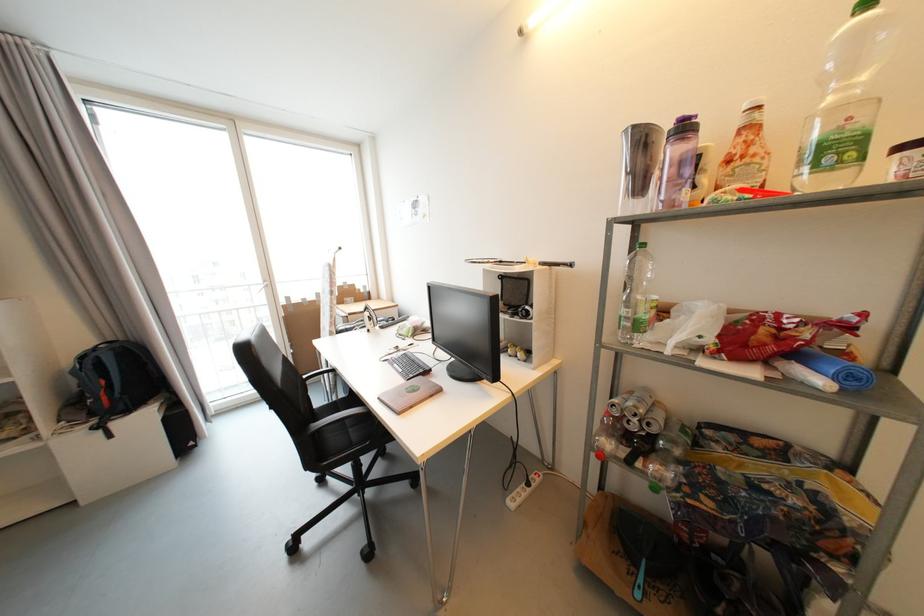
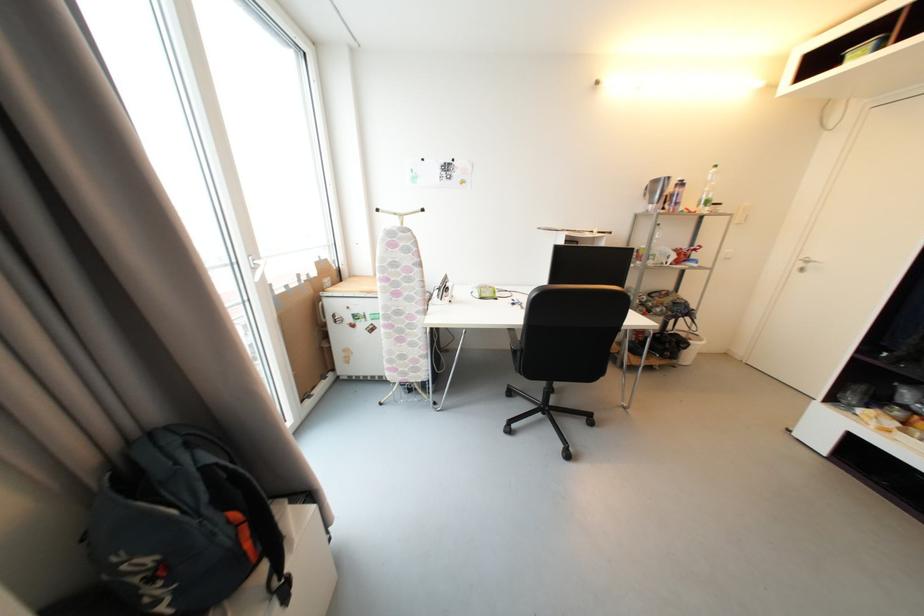
Locate, in the second image, the point that corresponds to [673,155] in the first image.

(674, 192)